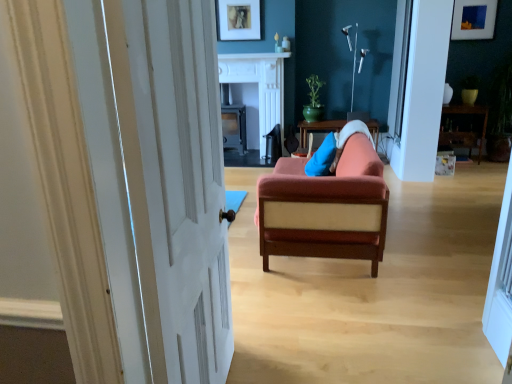
Question: Is white painted wood door at left placed right next to matte black fireplace at center, which is the second table from right to left?

Choices:
 (A) yes
 (B) no

Answer: (B)

Question: Are white painted wood door at left and matte black fireplace at center, which is the 1th table in left-to-right order, located far from each other?

Choices:
 (A) yes
 (B) no

Answer: (A)

Question: From a real-world perspective, is white painted wood door at left on matte black fireplace at center, which is the second table from right to left?

Choices:
 (A) no
 (B) yes

Answer: (B)

Question: Does white painted wood door at left have a lesser height compared to matte black fireplace at center, which is the second table from right to left?

Choices:
 (A) no
 (B) yes

Answer: (A)

Question: Can you confirm if white painted wood door at left is bigger than matte black fireplace at center, which is the 1th table in left-to-right order?

Choices:
 (A) no
 (B) yes

Answer: (A)

Question: From a real-world perspective, is white painted wood door at left positioned under matte black fireplace at center, which is the second table from right to left, based on gravity?

Choices:
 (A) yes
 (B) no

Answer: (B)

Question: From a real-world perspective, does white painted wood door at left sit lower than wooden table at right, the 1th table in the right-to-left sequence?

Choices:
 (A) yes
 (B) no

Answer: (B)

Question: Could you tell me if white painted wood door at left is facing wooden table at right, the 1th table in the right-to-left sequence?

Choices:
 (A) no
 (B) yes

Answer: (A)

Question: From a real-world perspective, is white painted wood door at left positioned over wooden table at right, the 1th table in the right-to-left sequence, based on gravity?

Choices:
 (A) no
 (B) yes

Answer: (B)

Question: Is white painted wood door at left bigger than wooden table at right, the 1th table in the right-to-left sequence?

Choices:
 (A) yes
 (B) no

Answer: (B)

Question: Is white painted wood door at left not close to wooden table at right, the 1th table in the right-to-left sequence?

Choices:
 (A) no
 (B) yes

Answer: (B)

Question: Is white painted wood door at left to the left of wooden table at right, which is the 2th table from left to right, from the viewer's perspective?

Choices:
 (A) yes
 (B) no

Answer: (A)

Question: Considering the relative sizes of white marble fireplace at center and velvet orange sofa at center in the image provided, is white marble fireplace at center taller than velvet orange sofa at center?

Choices:
 (A) no
 (B) yes

Answer: (B)